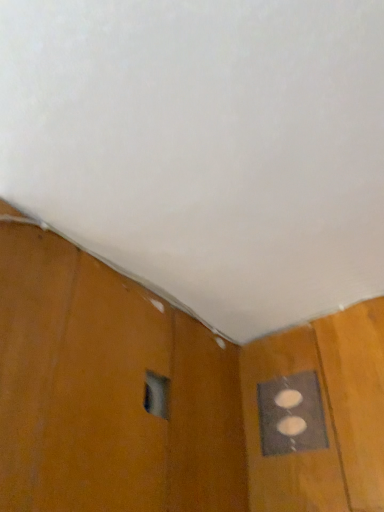
What is the approximate height of matte gray outlet at lower right?

The height of matte gray outlet at lower right is 19.40 centimeters.

Find the location of a particular element. matte gray outlet at lower right is located at coordinates (291, 415).

Measure the distance between matte gray outlet at lower right and camera.

37.24 inches.

What do you see at coordinates (291, 415) in the screenshot?
I see `matte gray outlet at lower right` at bounding box center [291, 415].

At what (x,y) coordinates should I click in order to perform the action: click on matte gray outlet at lower right. Please return your answer as a coordinate pair (x, y). Looking at the image, I should click on (291, 415).